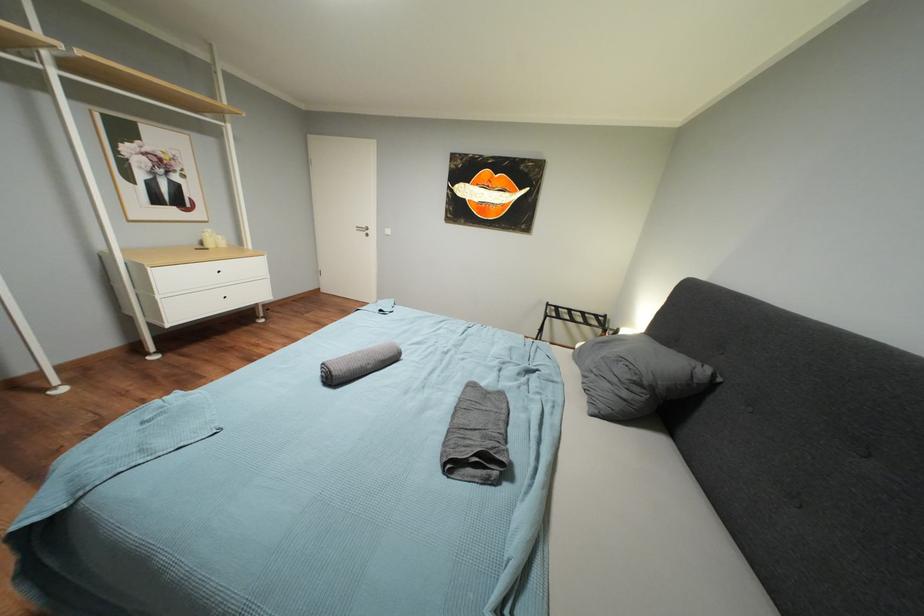
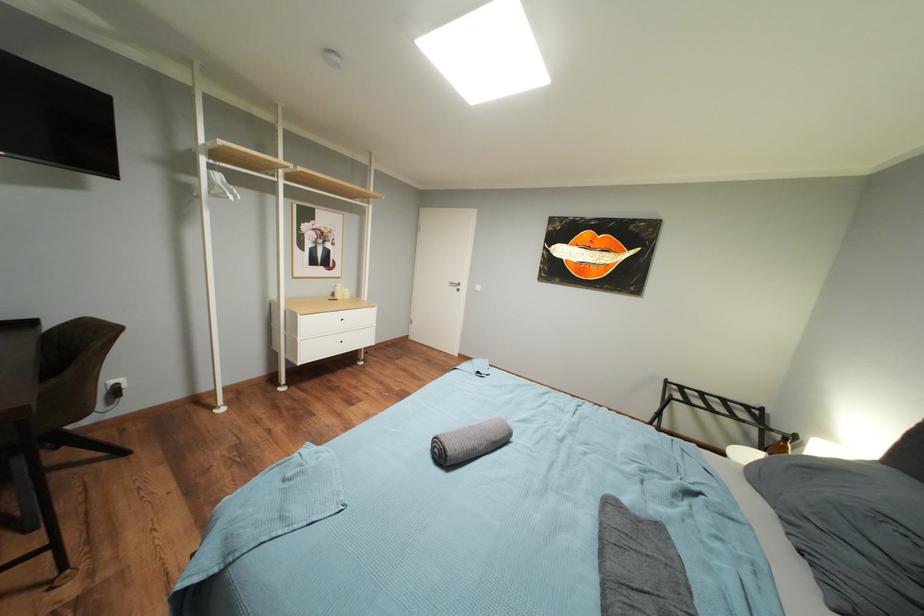
Question: The camera is either moving clockwise (left) or counter-clockwise (right) around the object. The first image is from the beginning of the video and the second image is from the end. Is the camera moving left or right when shooting the video?

Choices:
 (A) Left
 (B) Right

Answer: (B)